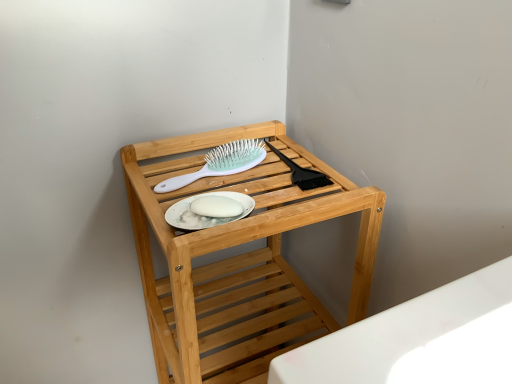
Question: Is natural wood shelf at center thinner than white matte platter at center?

Choices:
 (A) no
 (B) yes

Answer: (A)

Question: Is natural wood shelf at center not within white matte platter at center?

Choices:
 (A) yes
 (B) no

Answer: (A)

Question: Does natural wood shelf at center appear on the right side of white matte platter at center?

Choices:
 (A) yes
 (B) no

Answer: (A)

Question: Is natural wood shelf at center not near white matte platter at center?

Choices:
 (A) yes
 (B) no

Answer: (B)

Question: Is natural wood shelf at center smaller than white matte platter at center?

Choices:
 (A) yes
 (B) no

Answer: (B)

Question: From the image's perspective, would you say natural wood shelf at center is shown under white matte platter at center?

Choices:
 (A) no
 (B) yes

Answer: (B)

Question: Can you confirm if white plastic hairbrush at upper center is thinner than white matte platter at center?

Choices:
 (A) no
 (B) yes

Answer: (A)

Question: Would you say white matte platter at center is part of white plastic hairbrush at upper center's contents?

Choices:
 (A) yes
 (B) no

Answer: (B)

Question: From a real-world perspective, is white plastic hairbrush at upper center physically below white matte platter at center?

Choices:
 (A) yes
 (B) no

Answer: (A)

Question: Is white plastic hairbrush at upper center next to white matte platter at center and touching it?

Choices:
 (A) no
 (B) yes

Answer: (A)

Question: Does white plastic hairbrush at upper center have a lesser height compared to white matte platter at center?

Choices:
 (A) yes
 (B) no

Answer: (B)

Question: Could you tell me if white plastic hairbrush at upper center is turned towards white matte platter at center?

Choices:
 (A) no
 (B) yes

Answer: (A)

Question: From the image's perspective, is white plastic hairbrush at upper center on top of natural wood shelf at center?

Choices:
 (A) yes
 (B) no

Answer: (A)